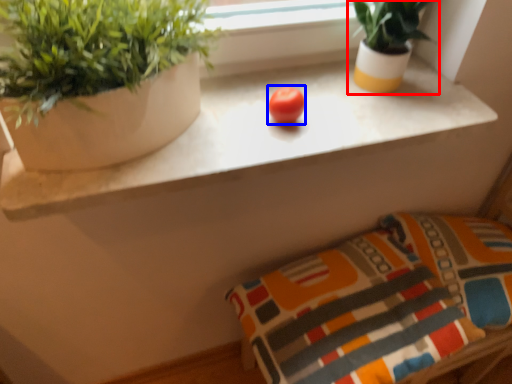
Question: Which object appears closest to the camera in this image, houseplant (highlighted by a red box) or fruit (highlighted by a blue box)?

Choices:
 (A) houseplant
 (B) fruit

Answer: (A)